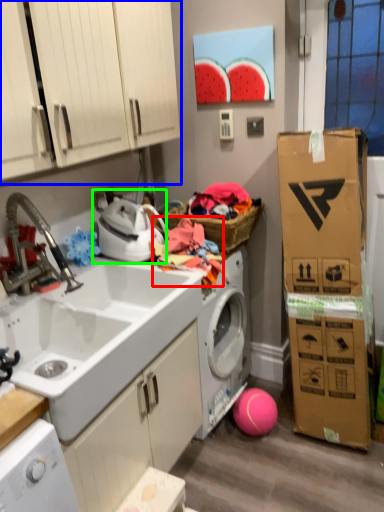
Question: Estimate the real-world distances between objects in this image. Which object is farther from clothing (highlighted by a red box), cabinetry (highlighted by a blue box) or appliance (highlighted by a green box)?

Choices:
 (A) cabinetry
 (B) appliance

Answer: (A)